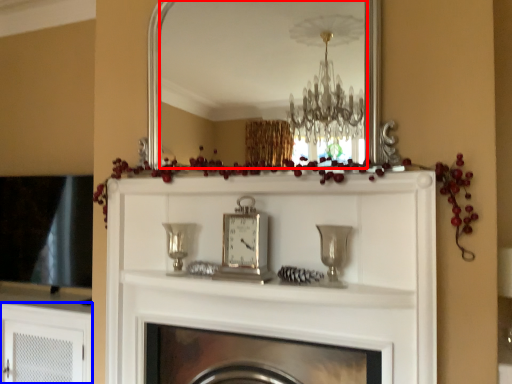
Question: Which object appears farthest to the camera in this image, mirror (highlighted by a red box) or cabinetry (highlighted by a blue box)?

Choices:
 (A) mirror
 (B) cabinetry

Answer: (B)